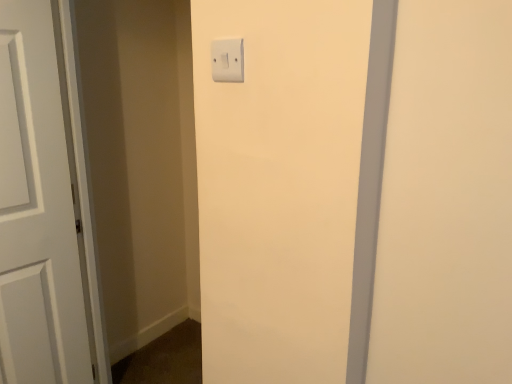
Question: From the image's perspective, relative to white matte door at left, is white plastic light switch at upper center above or below?

Choices:
 (A) above
 (B) below

Answer: (A)

Question: Considering the positions of white plastic light switch at upper center and white matte door at left in the image, is white plastic light switch at upper center bigger or smaller than white matte door at left?

Choices:
 (A) small
 (B) big

Answer: (A)

Question: Is white plastic light switch at upper center inside or outside of white matte door at left?

Choices:
 (A) outside
 (B) inside

Answer: (A)

Question: Is point (32, 86) closer or farther from the camera than point (230, 39)?

Choices:
 (A) farther
 (B) closer

Answer: (A)

Question: Considering the positions of white matte door at left and white plastic light switch at upper center in the image, is white matte door at left bigger or smaller than white plastic light switch at upper center?

Choices:
 (A) small
 (B) big

Answer: (B)

Question: Is white matte door at left inside the boundaries of white plastic light switch at upper center, or outside?

Choices:
 (A) inside
 (B) outside

Answer: (B)

Question: Relative to white plastic light switch at upper center, is white matte door at left in front or behind?

Choices:
 (A) front
 (B) behind

Answer: (B)